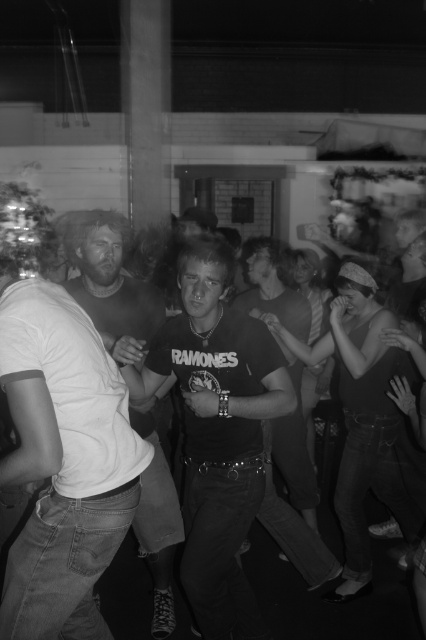
You are standing at the point with coordinates (x=218, y=429) in the image. What object is directly beneath your feet?

The point at coordinates (x=218, y=429) is on the matte black t shirt at center, so the object directly beneath your feet is the matte black t shirt at center.